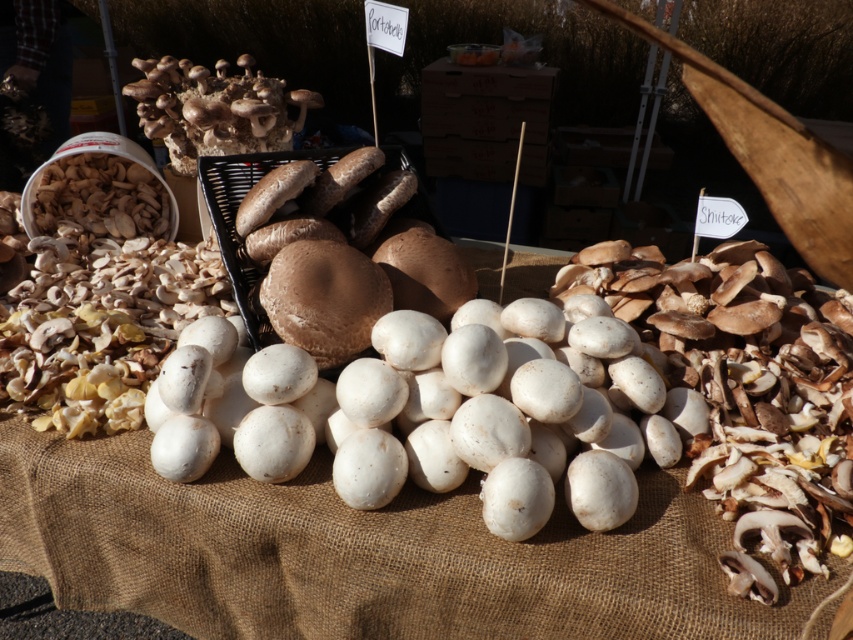
You are a customer at an outdoor market and want to buy the brown matte mushrooms at center. The vendor tells you that the mushrooms at the point with coordinates [363,275] are the ones you want. Based on the scene description, where exactly are the brown matte mushrooms located?

The brown matte mushrooms at center are located at the point with coordinates [363,275], which is indicated by the point in the scene description.

You are standing in front of the table with mushrooms. There are two points marked on the table surface. The first point is at coordinate point(270, 284) and the second is at point(138, 116). Which point is closer to you?

Point(270, 284) is closer to the camera than point(138, 116), so the first point is closer to you.

You are a chef preparing a dish and need to locate the brown matte mushrooms at center. Based on the scene description, where would you find them relative to the white button mushrooms?

The brown matte mushrooms at center are located behind the white button mushrooms in the foreground, placed in a black plastic crate.